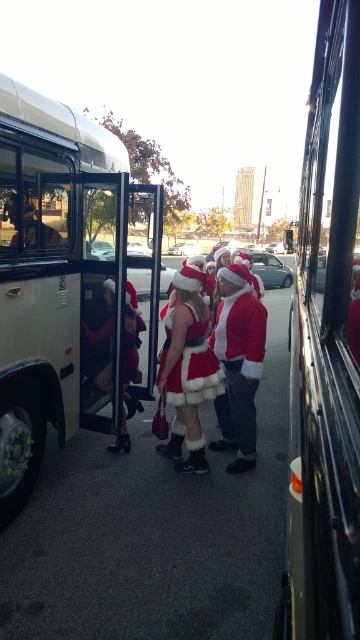
Which is in front, point (237, 314) or point (209, 365)?

Point (209, 365)

Does point (231, 284) come closer to viewer compared to point (182, 358)?

No, it is behind (182, 358).

This screenshot has width=360, height=640. Identify the location of fuzzy white santa suit at center. (237, 364).

Does white matte bus at center have a greater height compared to fuzzy red santa at center?

Yes, white matte bus at center is taller than fuzzy red santa at center.

At what (x,y) coordinates should I click in order to perform the action: click on white matte bus at center. Please return your answer as a coordinate pair (x, y). Looking at the image, I should click on (64, 282).

Who is more forward, [86,150] or [181,353]?

Point [181,353] is in front.

At what (x,y) coordinates should I click in order to perform the action: click on white matte bus at center. Please return your answer as a coordinate pair (x, y). Looking at the image, I should click on click(x=64, y=282).

Which is above, fuzzy red santa at center or fuzzy red dress at center?

Positioned higher is fuzzy red dress at center.

Who is positioned more to the left, fuzzy red santa at center or fuzzy red dress at center?

fuzzy red santa at center is more to the left.

Where is `fuzzy red santa at center`? The height and width of the screenshot is (640, 360). fuzzy red santa at center is located at coordinates (187, 369).

You are a GUI agent. You are given a task and a screenshot of the screen. Output one action in this format:
    pyautogui.click(x=<x>, y=<y>)
    Task: Click on the fuzzy red santa at center
    The image size is (360, 640).
    Given the screenshot: What is the action you would take?
    pyautogui.click(x=187, y=369)